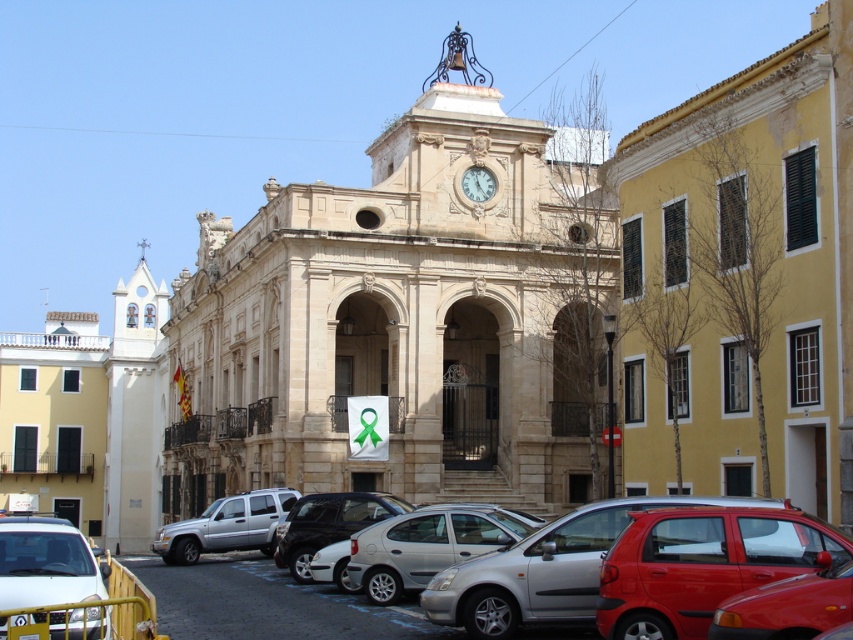
You are a city planner assessing the urban layout. Given the beige stone church at center and the yellow matte building at center, which one has a larger footprint in the cityscape?

The beige stone church at center has a larger footprint than the yellow matte building at center.

You are driving a car that is 1.8 meters wide and want to park it in the parking space between the silver metallic hatchback at center and the white marble clock at center. Can you fit your car in that space?

The silver metallic hatchback at center might be wider than white marble clock at center, so the available space between them may not be sufficient for a car that is 1.8 meters wide. It is uncertain if there is enough room without more precise measurements.